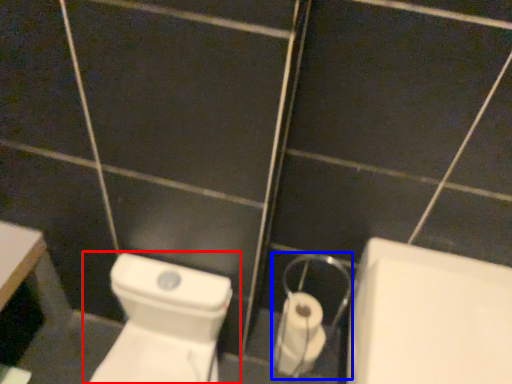
Question: Which point is further to the camera, toilet (highlighted by a red box) or dispenser (highlighted by a blue box)?

Choices:
 (A) toilet
 (B) dispenser

Answer: (B)